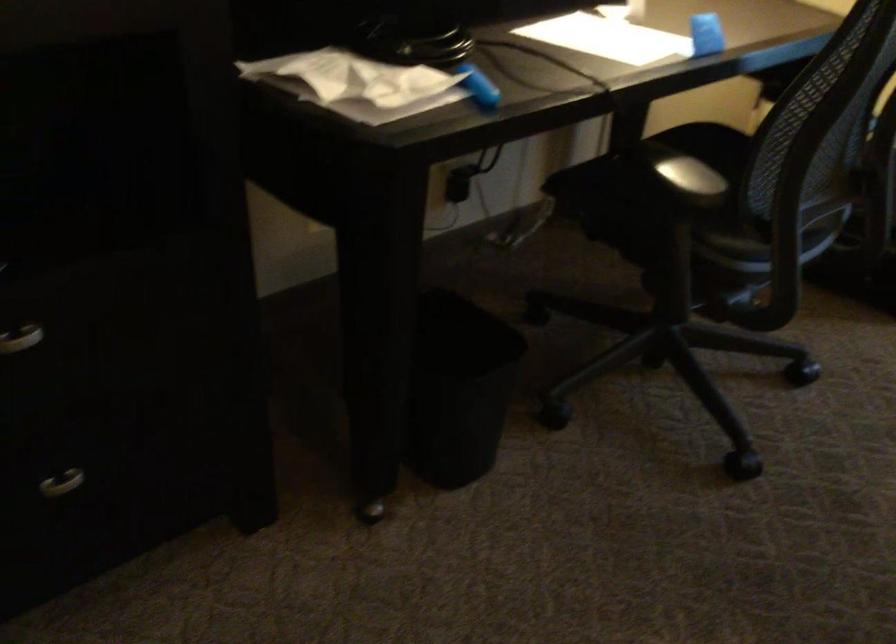
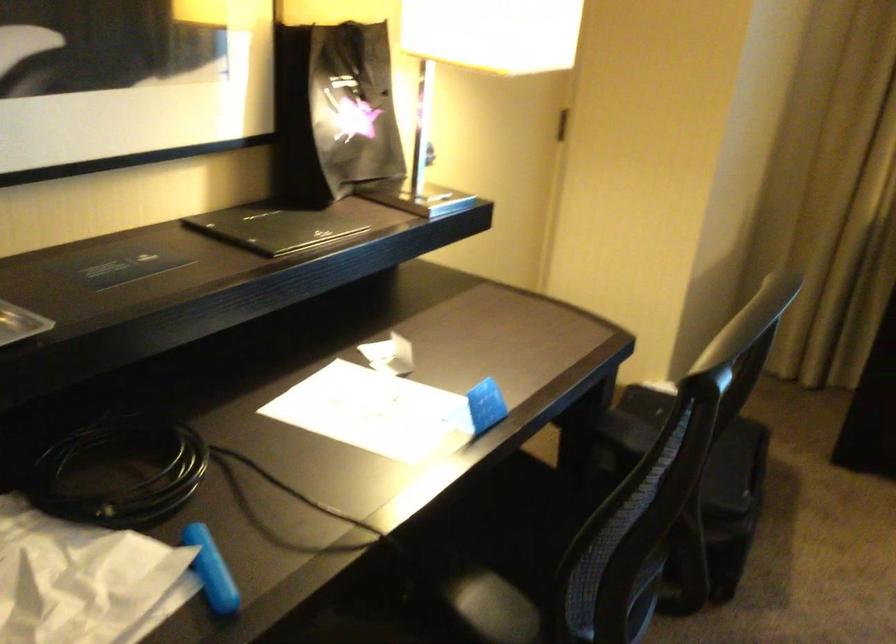
Question: The images are taken continuously from a first-person perspective. In which direction are you moving?

Choices:
 (A) Left
 (B) Right
 (C) Forward
 (D) Backward

Answer: (C)